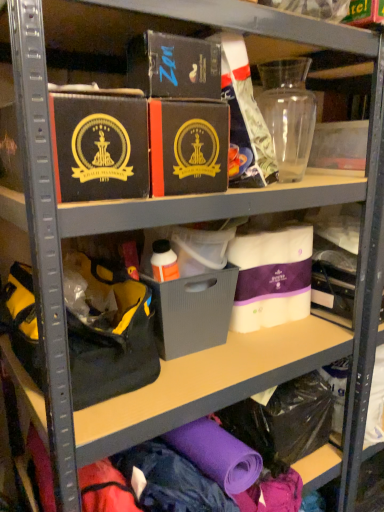
Question: From a real-world perspective, is matte black box at center, the second box in the left-to-right sequence, located beneath white fabric quilted mattress at center, the first box when ordered from right to left?

Choices:
 (A) no
 (B) yes

Answer: (A)

Question: From the image's perspective, is matte black box at center, the second box in the left-to-right sequence, on white fabric quilted mattress at center, which is counted as the 4th box, starting from the left?

Choices:
 (A) yes
 (B) no

Answer: (A)

Question: Can you confirm if matte black box at center, the second box in the left-to-right sequence, is wider than white fabric quilted mattress at center, which is counted as the 4th box, starting from the left?

Choices:
 (A) yes
 (B) no

Answer: (A)

Question: Is matte black box at center, the 3th box viewed from the right, facing away from white fabric quilted mattress at center, which is counted as the 4th box, starting from the left?

Choices:
 (A) yes
 (B) no

Answer: (B)

Question: Is white fabric quilted mattress at center, which is counted as the 4th box, starting from the left, a part of matte black box at center, the second box in the left-to-right sequence?

Choices:
 (A) no
 (B) yes

Answer: (A)

Question: From a real-world perspective, is black fabric handbag at left positioned above or below white fabric quilted mattress at center, the first box when ordered from right to left?

Choices:
 (A) above
 (B) below

Answer: (B)

Question: From the image's perspective, relative to white fabric quilted mattress at center, the first box when ordered from right to left, is black fabric handbag at left above or below?

Choices:
 (A) above
 (B) below

Answer: (B)

Question: Does point (135, 310) appear closer or farther from the camera than point (307, 236)?

Choices:
 (A) closer
 (B) farther

Answer: (A)

Question: Would you say black fabric handbag at left is inside or outside white fabric quilted mattress at center, which is counted as the 4th box, starting from the left?

Choices:
 (A) inside
 (B) outside

Answer: (B)

Question: From a real-world perspective, is white fabric quilted mattress at center, which is counted as the 4th box, starting from the left, above or below matte black box at center, the 3th box viewed from the right?

Choices:
 (A) above
 (B) below

Answer: (B)

Question: Is white fabric quilted mattress at center, the first box when ordered from right to left, in front of or behind matte black box at center, the 3th box viewed from the right, in the image?

Choices:
 (A) front
 (B) behind

Answer: (B)

Question: Is white fabric quilted mattress at center, which is counted as the 4th box, starting from the left, inside or outside of matte black box at center, the 3th box viewed from the right?

Choices:
 (A) outside
 (B) inside

Answer: (A)

Question: Considering the relative positions of white fabric quilted mattress at center, the first box when ordered from right to left, and matte black box at center, the 3th box viewed from the right, in the image provided, is white fabric quilted mattress at center, the first box when ordered from right to left, to the left or to the right of matte black box at center, the 3th box viewed from the right,?

Choices:
 (A) right
 (B) left

Answer: (A)

Question: Looking at the image, does matte black box at center, the 3th box viewed from the right, seem bigger or smaller compared to white fabric quilted mattress at center, the first box when ordered from right to left?

Choices:
 (A) big
 (B) small

Answer: (A)

Question: From a real-world perspective, is matte black box at center, the 3th box viewed from the right, positioned above or below white fabric quilted mattress at center, which is counted as the 4th box, starting from the left?

Choices:
 (A) below
 (B) above

Answer: (B)